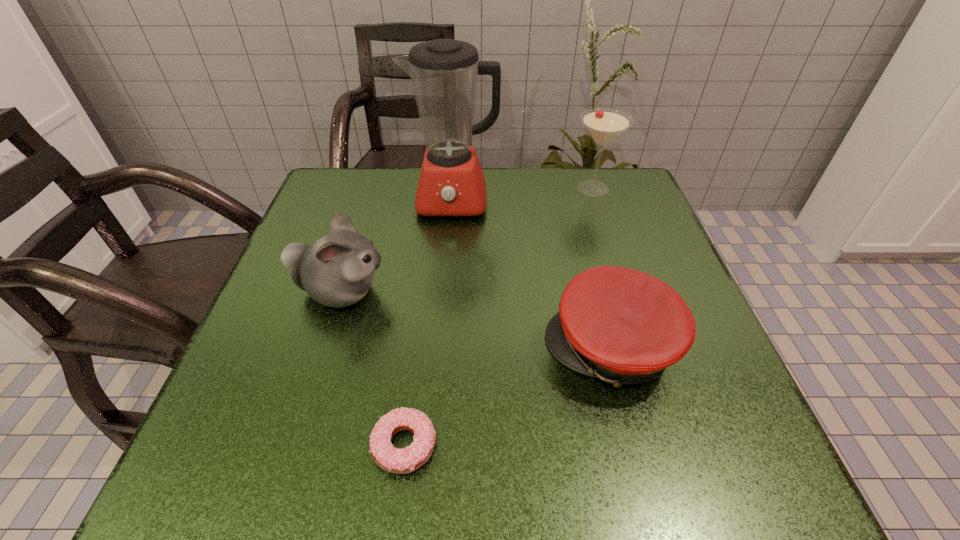
This screenshot has height=540, width=960. Identify the location of object that is positioned at the far right corner. (604, 125).

Find the location of a particular element. The width and height of the screenshot is (960, 540). vacant space at the far edge is located at coordinates (493, 207).

In order to click on free region at the near edge of the desktop in this screenshot , I will do `click(550, 491)`.

Locate an element on the screen. free spot at the left edge of the desktop is located at coordinates (235, 382).

At what (x,y) coordinates should I click in order to perform the action: click on free point at the right edge. Please return your answer as a coordinate pair (x, y). The image size is (960, 540). Looking at the image, I should click on (648, 427).

The height and width of the screenshot is (540, 960). What are the coordinates of `vacant point at the far left corner` in the screenshot? It's located at (323, 198).

In the image, there is a desktop. In order to click on vacant space at the near left corner in this screenshot , I will do `click(221, 455)`.

In the image, there is a desktop. Identify the location of vacant space at the far right corner. (621, 205).

Image resolution: width=960 pixels, height=540 pixels. I want to click on free space between the martini and the leftmost object, so click(x=467, y=241).

The width and height of the screenshot is (960, 540). In order to click on free spot between the martini and the shortest object in this screenshot , I will do `click(498, 317)`.